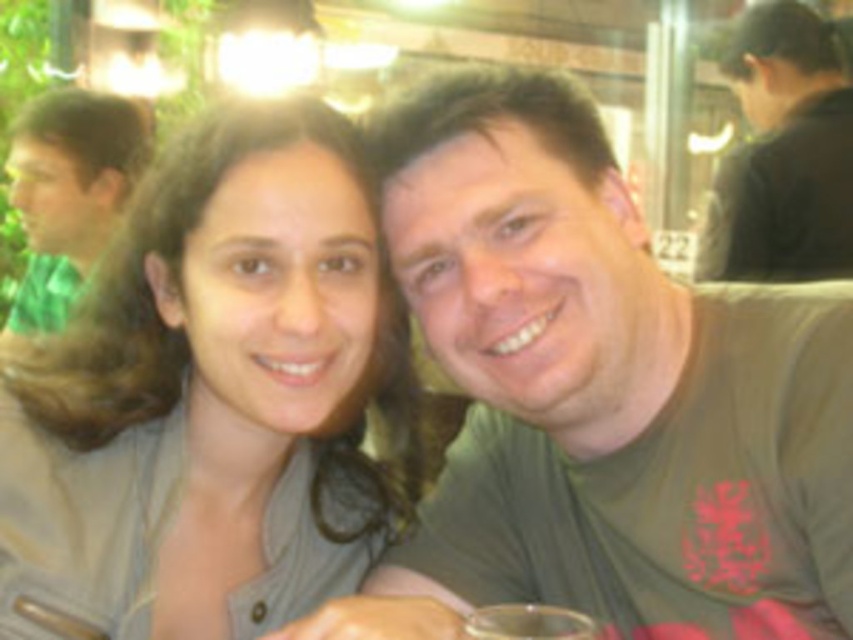
Which of these two, dark brown hair at upper right or clear plastic cup at center, stands taller?

dark brown hair at upper right

Is the position of dark brown hair at upper right less distant than that of clear plastic cup at center?

No, dark brown hair at upper right is further to the viewer.

Image resolution: width=853 pixels, height=640 pixels. I want to click on dark brown hair at upper right, so click(782, 154).

Is green matte shirt at center above matte gray shirt at center?

No.

Can you confirm if green matte shirt at center is shorter than matte gray shirt at center?

No.

Who is more distant from viewer, (608, 228) or (294, 484)?

The point (294, 484) is more distant.

Where is `green matte shirt at center`? Image resolution: width=853 pixels, height=640 pixels. green matte shirt at center is located at coordinates (601, 394).

Is green matte shirt at center closer to the viewer compared to dark brown hair at upper right?

Yes, it is in front of dark brown hair at upper right.

Can you confirm if green matte shirt at center is bigger than dark brown hair at upper right?

Incorrect, green matte shirt at center is not larger than dark brown hair at upper right.

At what (x,y) coordinates should I click in order to perform the action: click on green matte shirt at center. Please return your answer as a coordinate pair (x, y). This screenshot has height=640, width=853. Looking at the image, I should click on (601, 394).

Image resolution: width=853 pixels, height=640 pixels. Find the location of `green matte shirt at center`. green matte shirt at center is located at coordinates (601, 394).